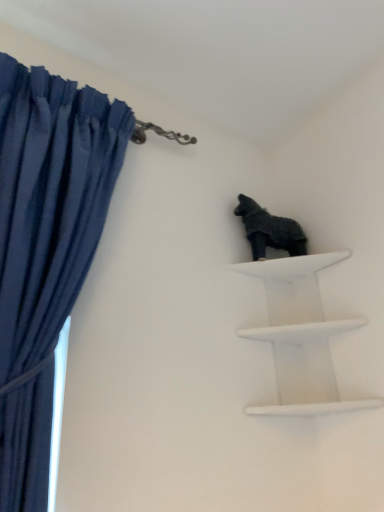
Question: From the image's perspective, is shiny black statue at upper right on top of dark blue fabric at left?

Choices:
 (A) no
 (B) yes

Answer: (B)

Question: Is shiny black statue at upper right next to dark blue fabric at left?

Choices:
 (A) yes
 (B) no

Answer: (B)

Question: Does shiny black statue at upper right have a larger size compared to dark blue fabric at left?

Choices:
 (A) no
 (B) yes

Answer: (A)

Question: Does shiny black statue at upper right lie behind dark blue fabric at left?

Choices:
 (A) yes
 (B) no

Answer: (A)

Question: Is shiny black statue at upper right positioned far away from dark blue fabric at left?

Choices:
 (A) yes
 (B) no

Answer: (B)

Question: From a real-world perspective, relative to shiny black statue at upper right, is white matte shelf at upper right vertically above or below?

Choices:
 (A) above
 (B) below

Answer: (B)

Question: Choose the correct answer: Is white matte shelf at upper right inside shiny black statue at upper right or outside it?

Choices:
 (A) outside
 (B) inside

Answer: (A)

Question: Is white matte shelf at upper right in front of or behind shiny black statue at upper right in the image?

Choices:
 (A) behind
 (B) front

Answer: (B)

Question: Considering the positions of white matte shelf at upper right and shiny black statue at upper right in the image, is white matte shelf at upper right taller or shorter than shiny black statue at upper right?

Choices:
 (A) short
 (B) tall

Answer: (B)

Question: Is dark blue fabric at left in front of or behind white matte shelf at upper right in the image?

Choices:
 (A) behind
 (B) front

Answer: (B)

Question: Is dark blue fabric at left taller or shorter than white matte shelf at upper right?

Choices:
 (A) tall
 (B) short

Answer: (A)

Question: In terms of size, does dark blue fabric at left appear bigger or smaller than white matte shelf at upper right?

Choices:
 (A) big
 (B) small

Answer: (A)

Question: Is point (23, 147) positioned closer to the camera than point (299, 314)?

Choices:
 (A) closer
 (B) farther

Answer: (A)

Question: Choose the correct answer: Is shiny black statue at upper right inside white matte shelf at upper right or outside it?

Choices:
 (A) inside
 (B) outside

Answer: (B)

Question: Relative to white matte shelf at upper right, is shiny black statue at upper right in front or behind?

Choices:
 (A) behind
 (B) front

Answer: (A)